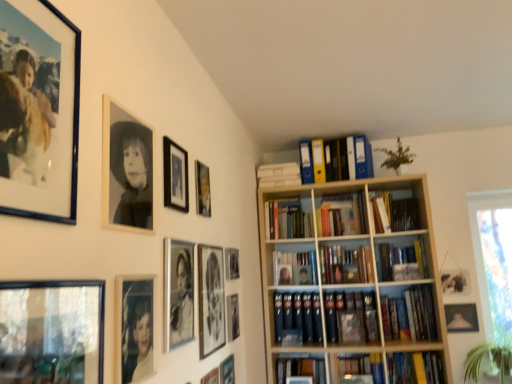
Question: Is matte gold picture frame at lower right, the 13th picture frame when ordered from left to right, not near green leafy plant at lower right, marked as the 2th plant in a top-to-bottom arrangement?

Choices:
 (A) no
 (B) yes

Answer: (A)

Question: Considering the relative sizes of matte gold picture frame at lower right, the 13th picture frame when ordered from left to right, and green leafy plant at lower right, the 2th plant from the left, in the image provided, is matte gold picture frame at lower right, the 13th picture frame when ordered from left to right, thinner than green leafy plant at lower right, the 2th plant from the left,?

Choices:
 (A) no
 (B) yes

Answer: (B)

Question: Is matte gold picture frame at lower right, the 13th picture frame when ordered from left to right, facing away from green leafy plant at lower right, the 2th plant from the left?

Choices:
 (A) no
 (B) yes

Answer: (A)

Question: From a real-world perspective, is matte gold picture frame at lower right, which is the first picture frame from right to left, beneath green leafy plant at lower right, the 2th plant from the left?

Choices:
 (A) yes
 (B) no

Answer: (B)

Question: Is matte gold picture frame at lower right, which is the first picture frame from right to left, facing towards green leafy plant at lower right, the 2th plant from the left?

Choices:
 (A) no
 (B) yes

Answer: (A)

Question: In terms of width, does matte black picture frame at upper center, the 5th picture frame from the left, look wider or thinner when compared to matte black picture frame at lower center, which appears as the tenth picture frame when viewed from the left?

Choices:
 (A) thin
 (B) wide

Answer: (B)

Question: Relative to matte black picture frame at lower center, the 4th picture frame positioned from the right, is matte black picture frame at upper center, the 9th picture frame from the right, in front or behind?

Choices:
 (A) behind
 (B) front

Answer: (B)

Question: Choose the correct answer: Is matte black picture frame at upper center, the 5th picture frame from the left, inside matte black picture frame at lower center, the 4th picture frame positioned from the right, or outside it?

Choices:
 (A) inside
 (B) outside

Answer: (B)

Question: Is point (181, 165) closer or farther from the camera than point (231, 367)?

Choices:
 (A) farther
 (B) closer

Answer: (B)

Question: From a real-world perspective, is matte black picture frame at upper left, placed as the 13th picture frame when sorted from right to left, physically located above or below matte black picture frame at upper center, the 3th picture frame in the right-to-left sequence?

Choices:
 (A) above
 (B) below

Answer: (A)

Question: From the image's perspective, is matte black picture frame at upper left, placed as the 13th picture frame when sorted from right to left, located above or below matte black picture frame at upper center, the 3th picture frame in the right-to-left sequence?

Choices:
 (A) below
 (B) above

Answer: (B)

Question: Is matte black picture frame at upper left, which is counted as the 1th picture frame, starting from the left, inside the boundaries of matte black picture frame at upper center, the 11th picture frame positioned from the left, or outside?

Choices:
 (A) outside
 (B) inside

Answer: (A)

Question: Considering the positions of matte black picture frame at upper left, which is counted as the 1th picture frame, starting from the left, and matte black picture frame at upper center, the 3th picture frame in the right-to-left sequence, in the image, is matte black picture frame at upper left, which is counted as the 1th picture frame, starting from the left, taller or shorter than matte black picture frame at upper center, the 3th picture frame in the right-to-left sequence,?

Choices:
 (A) short
 (B) tall

Answer: (B)

Question: Considering the positions of yellow plastic file at upper center, placed as the 1th book when sorted from top to bottom, and matte gold picture frame at lower right, the 13th picture frame when ordered from left to right, in the image, is yellow plastic file at upper center, placed as the 1th book when sorted from top to bottom, taller or shorter than matte gold picture frame at lower right, the 13th picture frame when ordered from left to right,?

Choices:
 (A) tall
 (B) short

Answer: (A)

Question: Is yellow plastic file at upper center, which appears as the fifth book when ordered from the bottom, inside the boundaries of matte gold picture frame at lower right, which is the first picture frame from right to left, or outside?

Choices:
 (A) inside
 (B) outside

Answer: (B)